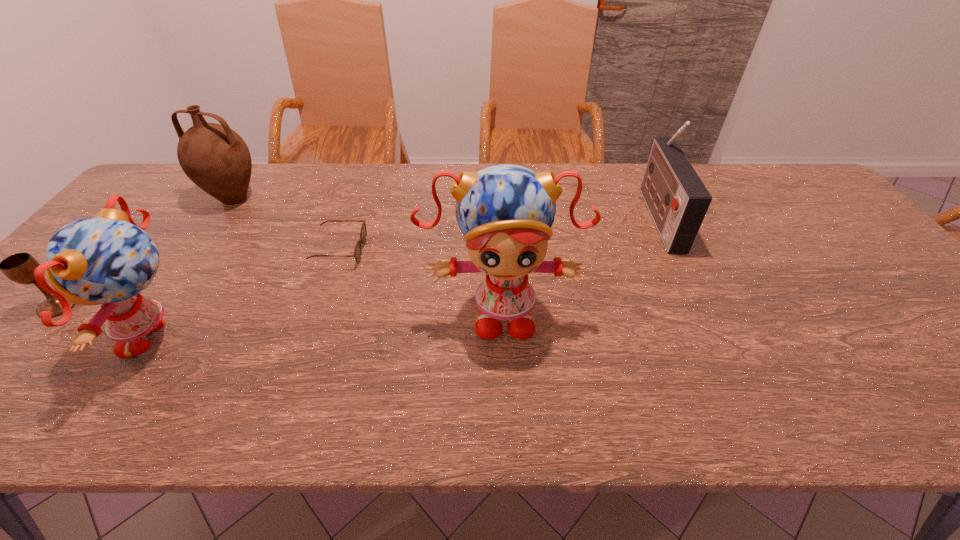
Locate an element on the screen. This screenshot has height=540, width=960. free space for a new doll on the right is located at coordinates (804, 287).